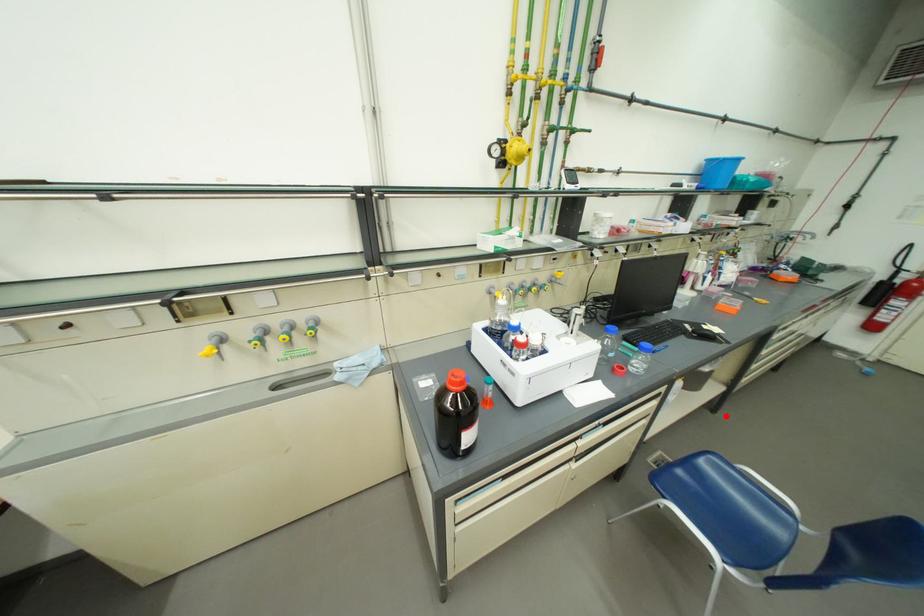
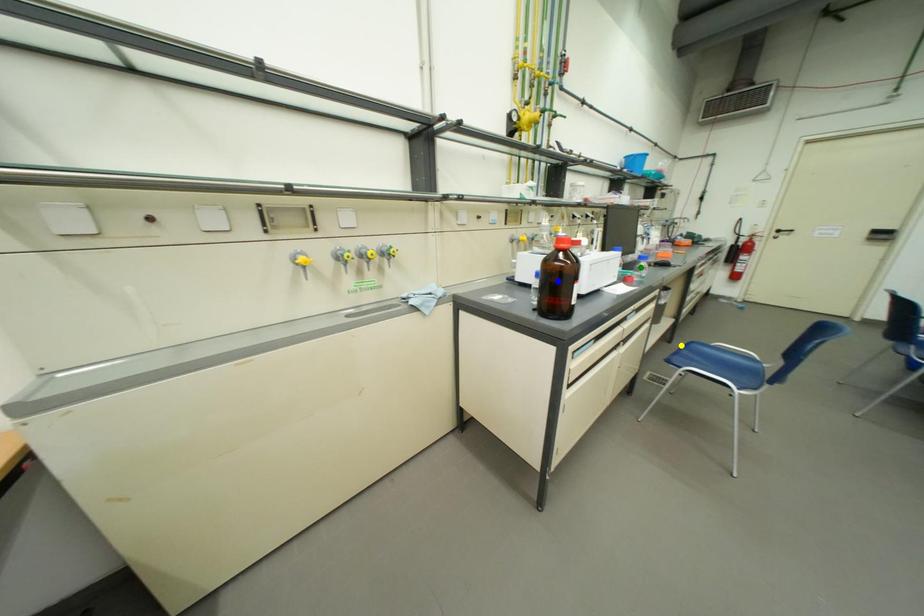
Question: I am providing you with two images of the same scene from different viewpoints. A red point is marked on the first image. You are given multiple points on the second image. Can you choose the point in image 2 that corresponds to the point in image 1?

Choices:
 (A) blue point
 (B) yellow point
 (C) green point

Answer: (B)